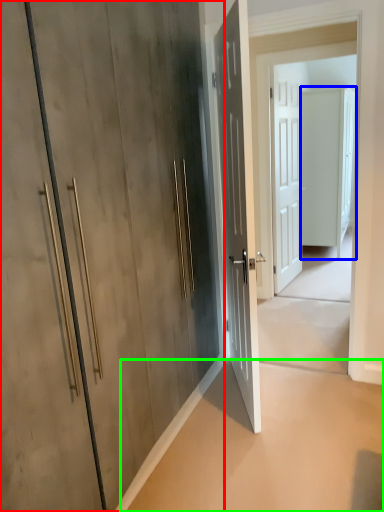
Question: Which object is positioned farthest from door (highlighted by a red box)? Select from door (highlighted by a blue box) and concrete (highlighted by a green box).

Choices:
 (A) door
 (B) concrete

Answer: (A)